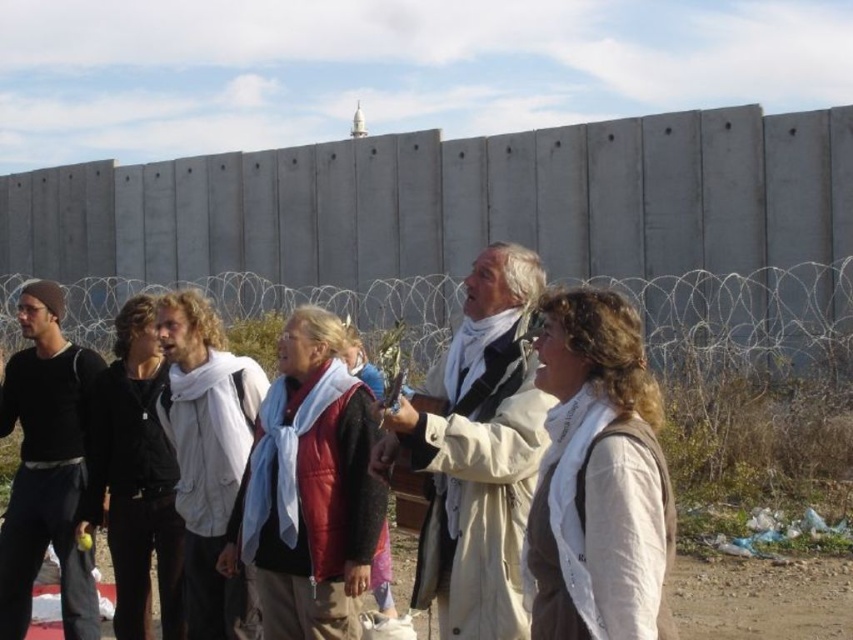
Can you confirm if concrete wall at upper center is positioned to the right of white wool scarf at center?

In fact, concrete wall at upper center is to the left of white wool scarf at center.

Between point (850, 116) and point (225, 602), which one is positioned behind?

Point (850, 116)

You are a GUI agent. You are given a task and a screenshot of the screen. Output one action in this format:
    pyautogui.click(x=<x>, y=<y>)
    Task: Click on the concrete wall at upper center
    
    Given the screenshot: What is the action you would take?
    pyautogui.click(x=479, y=218)

Based on the photo, can you confirm if concrete wall at upper center is wider than black matte pants at left?

Yes, concrete wall at upper center is wider than black matte pants at left.

Between concrete wall at upper center and black matte pants at left, which one appears on the left side from the viewer's perspective?

Positioned to the left is concrete wall at upper center.

Describe the element at coordinates (479, 218) in the screenshot. I see `concrete wall at upper center` at that location.

This screenshot has height=640, width=853. I want to click on concrete wall at upper center, so click(479, 218).

Which of these two, matte red leather jacket at center or white wool scarf at center, stands taller?

white wool scarf at center is taller.

Measure the distance between point (328,568) and camera.

21.00 meters

Where is `matte red leather jacket at center`? The image size is (853, 640). matte red leather jacket at center is located at coordinates (309, 488).